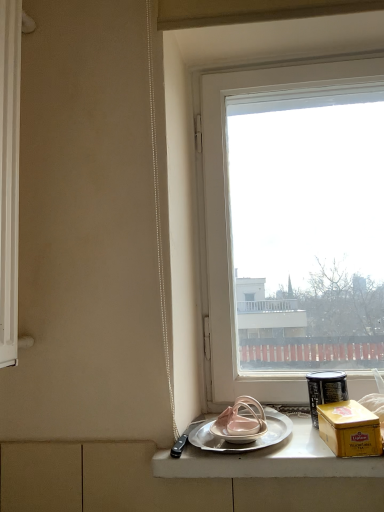
The height and width of the screenshot is (512, 384). Describe the element at coordinates (266, 457) in the screenshot. I see `silver metallic tray at lower center` at that location.

Locate an element on the screen. transparent glass window at center is located at coordinates point(294,226).

From the image's perspective, which is above, silver metallic tray at lower center or silver metallic plate at lower center?

silver metallic plate at lower center appears higher in the image.

Is silver metallic tray at lower center thinner than silver metallic plate at lower center?

Incorrect, the width of silver metallic tray at lower center is not less than that of silver metallic plate at lower center.

From the picture: Measure the distance from silver metallic tray at lower center to silver metallic plate at lower center.

They are 2.39 inches apart.

What's the angular difference between silver metallic tray at lower center and silver metallic plate at lower center's facing directions?

The facing directions of silver metallic tray at lower center and silver metallic plate at lower center are 0.000513 degrees apart.

Which of these two, silver metallic plate at lower center or metallic silver canister at right, is smaller?

With smaller size is metallic silver canister at right.

Between point (210, 450) and point (329, 382), which one is positioned in front?

Positioned in front is point (210, 450).

Considering the relative positions of silver metallic plate at lower center and metallic silver canister at right in the image provided, is silver metallic plate at lower center to the left of metallic silver canister at right from the viewer's perspective?

Indeed, silver metallic plate at lower center is positioned on the left side of metallic silver canister at right.

Can you confirm if transparent glass window at center is positioned to the right of silver metallic tray at lower center?

Indeed, transparent glass window at center is positioned on the right side of silver metallic tray at lower center.

Is point (367, 97) positioned in front of point (321, 442)?

No, (367, 97) is further to viewer.

From the image's perspective, relative to silver metallic tray at lower center, is transparent glass window at center above or below?

Based on their image positions, transparent glass window at center is located above silver metallic tray at lower center.

Is transparent glass window at center bigger or smaller than silver metallic tray at lower center?

transparent glass window at center is bigger than silver metallic tray at lower center.

Considering the relative sizes of silver metallic plate at lower center and silver metallic tray at lower center in the image provided, is silver metallic plate at lower center wider than silver metallic tray at lower center?

In fact, silver metallic plate at lower center might be narrower than silver metallic tray at lower center.

Which is nearer, (200,444) or (352,473)?

The point (352,473) is closer.

Consider the image. From a real-world perspective, who is located higher, silver metallic plate at lower center or silver metallic tray at lower center?

From a 3D spatial view, silver metallic plate at lower center is above.

Which object is closer to the camera, silver metallic plate at lower center or silver metallic tray at lower center?

silver metallic tray at lower center.

Could you tell me if yellow matte box at right is turned towards metallic silver canister at right?

No, yellow matte box at right is not facing towards metallic silver canister at right.

Measure the distance from yellow matte box at right to metallic silver canister at right.

yellow matte box at right is 3.60 inches away from metallic silver canister at right.

From a real-world perspective, which object rests below the other?

yellow matte box at right is physically lower.

Is silver metallic plate at lower center oriented away from transparent glass window at center?

Yes, silver metallic plate at lower center's orientation is away from transparent glass window at center.

From their relative heights in the image, would you say silver metallic plate at lower center is taller or shorter than transparent glass window at center?

Considering their sizes, silver metallic plate at lower center has less height than transparent glass window at center.

Which is in front, point (226, 443) or point (232, 239)?

Positioned in front is point (226, 443).

Can you confirm if silver metallic plate at lower center is wider than transparent glass window at center?

Indeed, silver metallic plate at lower center has a greater width compared to transparent glass window at center.

Would you say metallic silver canister at right contains silver metallic plate at lower center?

No.

Considering their positions, is metallic silver canister at right located in front of or behind silver metallic plate at lower center?

In the image, metallic silver canister at right appears behind silver metallic plate at lower center.

Would you say metallic silver canister at right is a long distance from silver metallic plate at lower center?

No, metallic silver canister at right is not far away from silver metallic plate at lower center.

What are the coordinates of `plate behind the silver metallic tray at lower center` in the screenshot? It's located at (246, 443).

The image size is (384, 512). Identify the location of tableware that appears above the silver metallic plate at lower center (from the image's perspective). (325, 390).

Which object lies nearer to the anchor point transparent glass window at center, metallic silver canister at right or silver metallic tray at lower center?

metallic silver canister at right is positioned closer to the anchor transparent glass window at center.

Estimate the real-world distances between objects in this image. Which object is closer to transparent glass window at center, yellow matte box at right or silver metallic plate at lower center?

The object closer to transparent glass window at center is silver metallic plate at lower center.

Looking at the image, which one is located closer to silver metallic plate at lower center, silver metallic tray at lower center or metallic silver canister at right?

silver metallic tray at lower center.

Looking at the image, which one is located closer to silver metallic plate at lower center, silver metallic tray at lower center or transparent glass window at center?

silver metallic tray at lower center.

When comparing their distances from metallic silver canister at right, does transparent glass window at center or silver metallic tray at lower center seem further?

transparent glass window at center is positioned further to the anchor metallic silver canister at right.

When comparing their distances from yellow matte box at right, does silver metallic tray at lower center or silver metallic plate at lower center seem closer?

Among the two, silver metallic tray at lower center is located nearer to yellow matte box at right.

From the image, which object appears to be nearer to silver metallic tray at lower center, metallic silver canister at right or transparent glass window at center?

Based on the image, metallic silver canister at right appears to be nearer to silver metallic tray at lower center.

Looking at the image, which one is located further to transparent glass window at center, silver metallic plate at lower center or metallic silver canister at right?

Based on the image, silver metallic plate at lower center appears to be further to transparent glass window at center.

Find the location of `box between silver metallic plate at lower center and metallic silver canister at right from left to right`. box between silver metallic plate at lower center and metallic silver canister at right from left to right is located at coordinates (349, 429).

At what (x,y) coordinates should I click in order to perform the action: click on tableware between transparent glass window at center and silver metallic tray at lower center in the up-down direction. Please return your answer as a coordinate pair (x, y). Looking at the image, I should click on (325, 390).

At what (x,y) coordinates should I click in order to perform the action: click on box between transparent glass window at center and silver metallic plate at lower center in the up-down direction. Please return your answer as a coordinate pair (x, y). The width and height of the screenshot is (384, 512). Looking at the image, I should click on (349, 429).

At what (x,y) coordinates should I click in order to perform the action: click on counter top between silver metallic plate at lower center and yellow matte box at right in the horizontal direction. Please return your answer as a coordinate pair (x, y). This screenshot has width=384, height=512. Looking at the image, I should click on (266, 457).